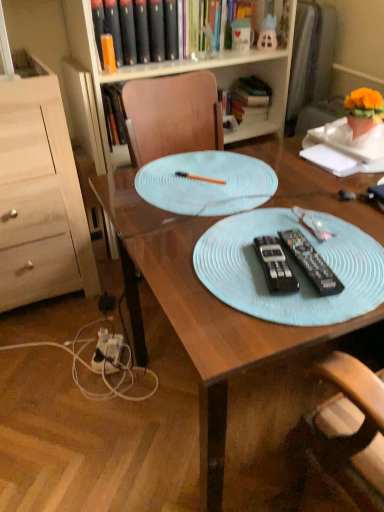
Locate an element on the screen. This screenshot has height=512, width=384. vacant space that is in between black plastic remote control at center, which appears as the 1th remote control when viewed from the left, and light blue textured placemat at upper center is located at coordinates (249, 232).